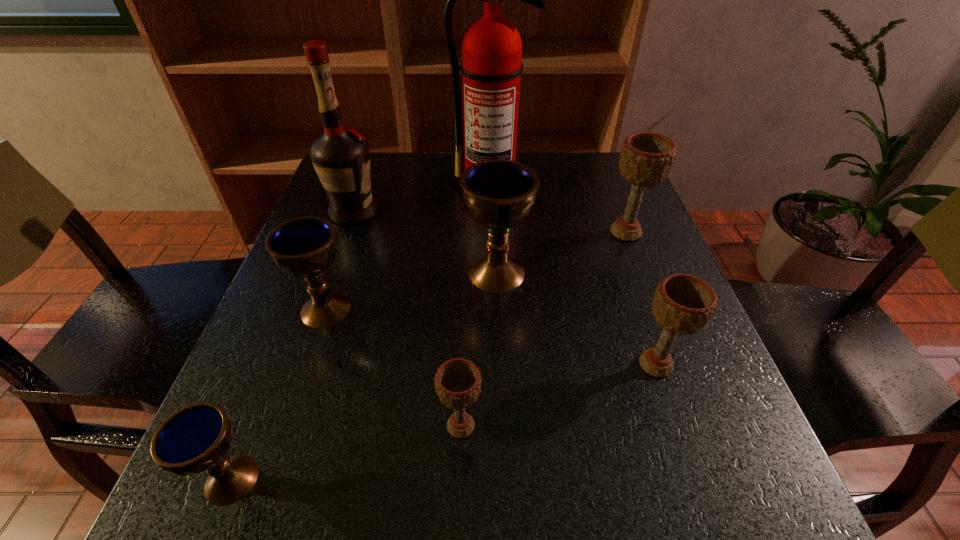
Locate which object ranks sixth in proximity to the second biggest blue chalice. Please provide its 2D coordinates. Your answer should be formatted as a tuple, i.e. [(x, y)], where the tuple contains the x and y coordinates of a point satisfying the conditions above.

[(683, 304)]

In order to click on chalice that is the second closest to the second biggest beige chalice in this screenshot , I will do `click(458, 381)`.

The image size is (960, 540). Identify the location of chalice identified as the sixth closest to the tallest object. (196, 438).

Point out which beige chalice is positioned as the third nearest to the second biggest blue chalice. Please provide its 2D coordinates. Your answer should be formatted as a tuple, i.e. [(x, y)], where the tuple contains the x and y coordinates of a point satisfying the conditions above.

[(646, 159)]

Where is `beige chalice that stands as the closest to the nearest beige chalice`? The height and width of the screenshot is (540, 960). beige chalice that stands as the closest to the nearest beige chalice is located at coordinates (683, 304).

Find the location of a particular element. Image resolution: width=960 pixels, height=540 pixels. blue chalice that is the closest one to the second tallest object is located at coordinates (305, 247).

Find the location of a particular element. This screenshot has height=540, width=960. the third closest blue chalice to the biggest beige chalice is located at coordinates (196, 438).

The height and width of the screenshot is (540, 960). What are the coordinates of `free space that satisfies the following two spatial constraints: 1. on the front and back of the biggest beige chalice; 2. on the right side of the second tallest object` in the screenshot? It's located at (348, 232).

This screenshot has height=540, width=960. I want to click on free region that satisfies the following two spatial constraints: 1. on the side of the tallest object near the handle; 2. on the front and back of the seventh shortest object, so click(492, 213).

Locate an element on the screen. The width and height of the screenshot is (960, 540). free spot that satisfies the following two spatial constraints: 1. on the side of the fire extinguisher near the handle; 2. on the right side of the biggest blue chalice is located at coordinates (493, 272).